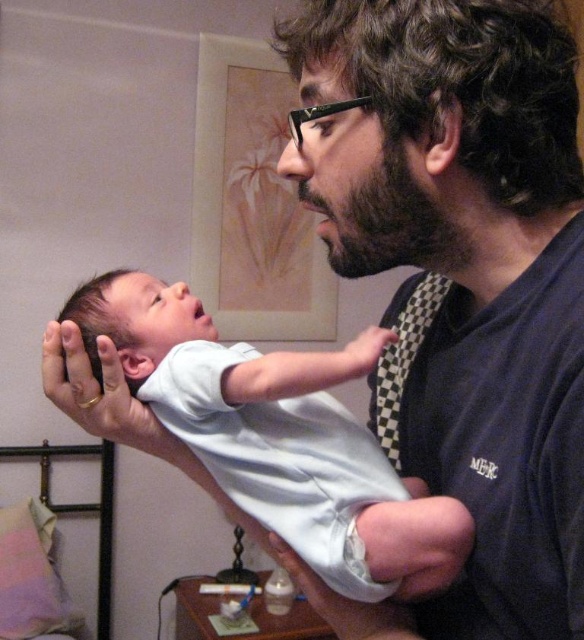
You are a photographer setting up for a portrait session. You need to ensure that the white cotton onesie at center and the dark brown thick beard at center are both in focus. The depth of field you can achieve with your current camera settings allows objects within 7 inches to be in focus. Will both objects be in focus?

The distance between the white cotton onesie at center and the dark brown thick beard at center is 7.70 inches. Since the depth of field only covers 7 inches, the objects are slightly out of the focus range. Therefore, not both will be in focus.

You are an interior designer assessing the wall space in this room. You need to hang a new artwork that is the same size as the dark brown thick beard at center. Can the space currently occupied by the matte paper picture frame at upper center accommodate this new artwork without resizing?

The matte paper picture frame at upper center is larger in size than the dark brown thick beard at center. Therefore, the space occupied by the matte paper picture frame at upper center can accommodate the new artwork since it is bigger than the beard.

You are a photographer taking a picture of the dark blue shirt at center and the white cotton onesie at center. Which one appears closer to you in the photo?

The dark blue shirt at center appears closer to you in the photo because it is physically closer to the viewer than the white cotton onesie at center.